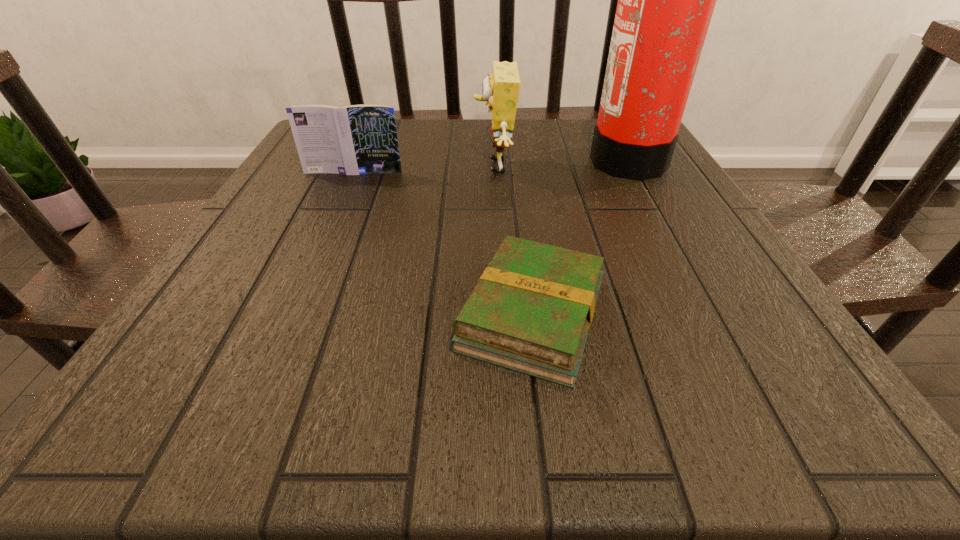
Where is `the rightmost object`? This screenshot has width=960, height=540. the rightmost object is located at coordinates (666, 0).

In order to click on fire extinguisher in this screenshot , I will do `click(666, 0)`.

Where is `the second tallest object`? The width and height of the screenshot is (960, 540). the second tallest object is located at coordinates (501, 89).

Locate an element on the screen. The height and width of the screenshot is (540, 960). the leftmost object is located at coordinates (358, 139).

You are a GUI agent. You are given a task and a screenshot of the screen. Output one action in this format:
    pyautogui.click(x=<x>, y=<y>)
    Task: Click on the farther book
    The height and width of the screenshot is (540, 960).
    Given the screenshot: What is the action you would take?
    pyautogui.click(x=358, y=139)

This screenshot has height=540, width=960. I want to click on the right book, so click(531, 311).

This screenshot has width=960, height=540. What are the coordinates of `the shorter book` in the screenshot? It's located at (531, 311).

I want to click on free space located on the front side of the fire extinguisher, so click(521, 158).

In order to click on vacant space located 0.220m on the front side of the fire extinguisher in this screenshot , I will do `click(495, 158)`.

Locate an element on the screen. The width and height of the screenshot is (960, 540). vacant area located 0.190m on the front side of the fire extinguisher is located at coordinates (509, 158).